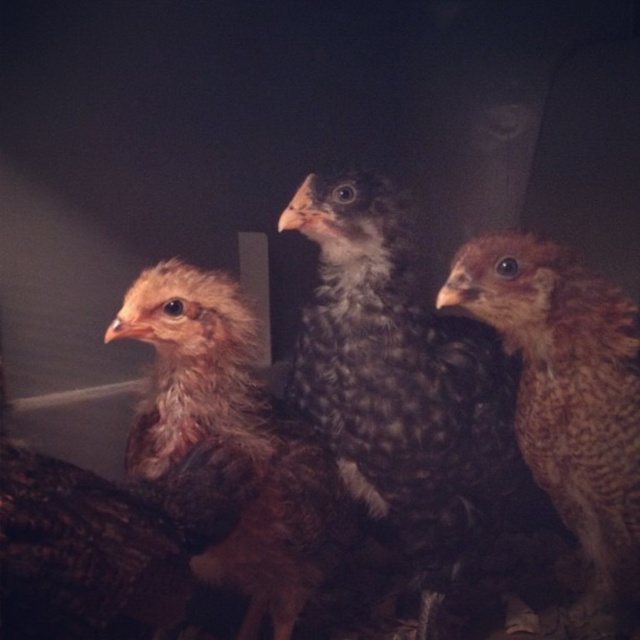
You are holding a camera and want to take a close up photo of the brown speckled feathers at center. If the camera is currently 3.46 feet away from the feathers, is the distance sufficient for a clear close up shot?

The brown speckled feathers at center and camera are 3.46 feet apart, so the distance of 3.46 feet is sufficient for a clear close up shot.